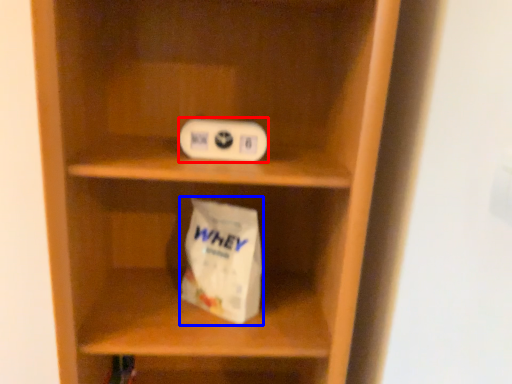
Question: Among these objects, which one is nearest to the camera, ipod (highlighted by a red box) or paper bag (highlighted by a blue box)?

Choices:
 (A) ipod
 (B) paper bag

Answer: (A)